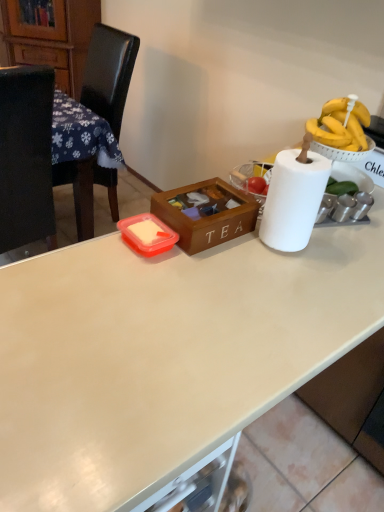
What do you see at coordinates (41, 155) in the screenshot? I see `white matte table at left` at bounding box center [41, 155].

Describe the element at coordinates (51, 36) in the screenshot. I see `wooden cabinet at left` at that location.

What do you see at coordinates (205, 213) in the screenshot? I see `wooden tea box at center` at bounding box center [205, 213].

The image size is (384, 512). Identify the location of white matte table at left. (41, 155).

Is white matte table at left far from wooden tea box at center?

They are positioned close to each other.

Which is in front, point (13, 244) or point (191, 206)?

The point (191, 206) is more forward.

How many degrees apart are the facing directions of white matte table at left and wooden tea box at center?

The facing directions of white matte table at left and wooden tea box at center are 0.379 degrees apart.

Looking at the image, does white matte table at left seem bigger or smaller compared to wooden tea box at center?

Clearly, white matte table at left is larger in size than wooden tea box at center.

Which is behind, point (51, 390) or point (235, 226)?

The point (235, 226) is farther.

Could you tell me if white matte desk at center is turned towards wooden tea box at center?

No, white matte desk at center is not turned towards wooden tea box at center.

Between white matte desk at center and wooden tea box at center, which one has larger width?

With larger width is white matte desk at center.

Are white matte desk at center and wooden tea box at center located far from each other?

No, white matte desk at center is in close proximity to wooden tea box at center.

Measure the distance from wooden tea box at center to white matte desk at center.

The distance of wooden tea box at center from white matte desk at center is 9.51 inches.

From a real-world perspective, is wooden tea box at center located beneath white matte desk at center?

No, from a real-world perspective, wooden tea box at center is not below white matte desk at center.

Does point (186, 211) lie behind point (37, 501)?

Yes, point (186, 211) is farther from viewer.

From the image's perspective, is wooden tea box at center located beneath white matte desk at center?

No, from the image's perspective, wooden tea box at center is not beneath white matte desk at center.

Which object is closer to the camera, white matte table at left or white matte desk at center?

Positioned in front is white matte desk at center.

Considering the positions of objects white matte table at left and white matte desk at center in the image provided, who is more to the right, white matte table at left or white matte desk at center?

From the viewer's perspective, white matte desk at center appears more on the right side.

Is the surface of black leather chair at left in direct contact with white matte table at left?

black leather chair at left is not next to white matte table at left, and they're not touching.

Identify the location of table that is on the left side of black leather chair at left. (41, 155).

From the image's perspective, which is below, black leather chair at left or white matte table at left?

From the image's view, white matte table at left is below.

From a real-world perspective, between black leather chair at left and white matte table at left, who is vertically higher?

From a 3D spatial view, black leather chair at left is above.

Considering their positions, is wooden cabinet at left located in front of or behind white matte desk at center?

In the image, wooden cabinet at left appears behind white matte desk at center.

Is wooden cabinet at left inside the boundaries of white matte desk at center, or outside?

wooden cabinet at left cannot be found inside white matte desk at center.

Are wooden cabinet at left and white matte desk at center located far from each other?

Absolutely, wooden cabinet at left is distant from white matte desk at center.

Does point (8, 5) appear closer or farther from the camera than point (15, 292)?

Point (8, 5) appears to be farther away from the viewer than point (15, 292).

From a real-world perspective, is wooden cabinet at left above or below wooden tea box at center?

From a real-world perspective, wooden cabinet at left is physically below wooden tea box at center.

Based on the photo, from the image's perspective, which one is positioned higher, wooden cabinet at left or wooden tea box at center?

wooden cabinet at left, from the image's perspective.

From the picture: Considering the positions of objects wooden cabinet at left and wooden tea box at center in the image provided, who is behind, wooden cabinet at left or wooden tea box at center?

wooden cabinet at left is behind.

Is wooden cabinet at left aimed at wooden tea box at center?

Yes, wooden cabinet at left is oriented towards wooden tea box at center.

The width and height of the screenshot is (384, 512). What are the coordinates of `box on the right of white matte table at left` in the screenshot? It's located at (205, 213).

Find the location of `desk in front of the wooden tea box at center`. desk in front of the wooden tea box at center is located at coordinates (165, 355).

Consider the image. Based on their spatial positions, is black leather chair at left or white matte desk at center further from wooden cabinet at left?

white matte desk at center lies further to wooden cabinet at left than the other object.

Based on their spatial positions, is white matte desk at center or wooden cabinet at left further from wooden tea box at center?

Based on the image, wooden cabinet at left appears to be further to wooden tea box at center.

Estimate the real-world distances between objects in this image. Which object is further from wooden tea box at center, black leather chair at left or white matte desk at center?

black leather chair at left is positioned further to the anchor wooden tea box at center.

When comparing their distances from black leather chair at left, does white matte desk at center or wooden tea box at center seem further?

Among the two, white matte desk at center is located further to black leather chair at left.

From the image, which object appears to be farther from black leather chair at left, wooden tea box at center or white matte table at left?

Among the two, wooden tea box at center is located further to black leather chair at left.

Considering their positions, is white matte desk at center positioned closer to black leather chair at left than white matte table at left?

white matte table at left.

Looking at this image, looking at the image, which one is located further to white matte table at left, black leather chair at left or wooden tea box at center?

wooden tea box at center is positioned further to the anchor white matte table at left.

From the image, which object appears to be nearer to black leather chair at left, white matte desk at center or wooden cabinet at left?

Among the two, wooden cabinet at left is located nearer to black leather chair at left.

At what (x,y) coordinates should I click in order to perform the action: click on table between wooden tea box at center and wooden cabinet at left in the front-back direction. Please return your answer as a coordinate pair (x, y). Looking at the image, I should click on (41, 155).

Identify the location of chair between white matte table at left and wooden cabinet at left from front to back. This screenshot has width=384, height=512. (109, 73).

Find the location of a particular element. chair positioned between wooden tea box at center and wooden cabinet at left from near to far is located at coordinates pyautogui.click(x=109, y=73).

I want to click on box between white matte desk at center and white matte table at left along the z-axis, so click(x=205, y=213).